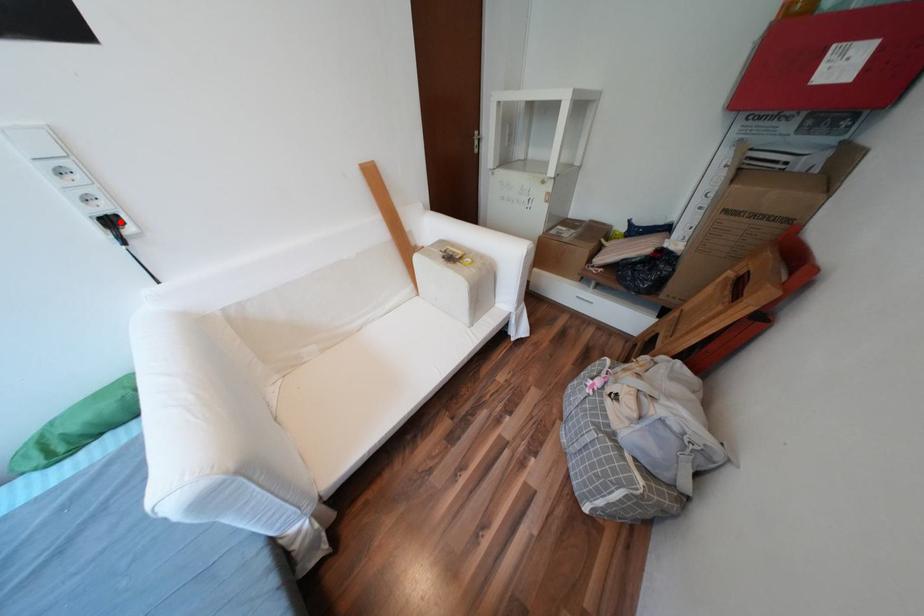
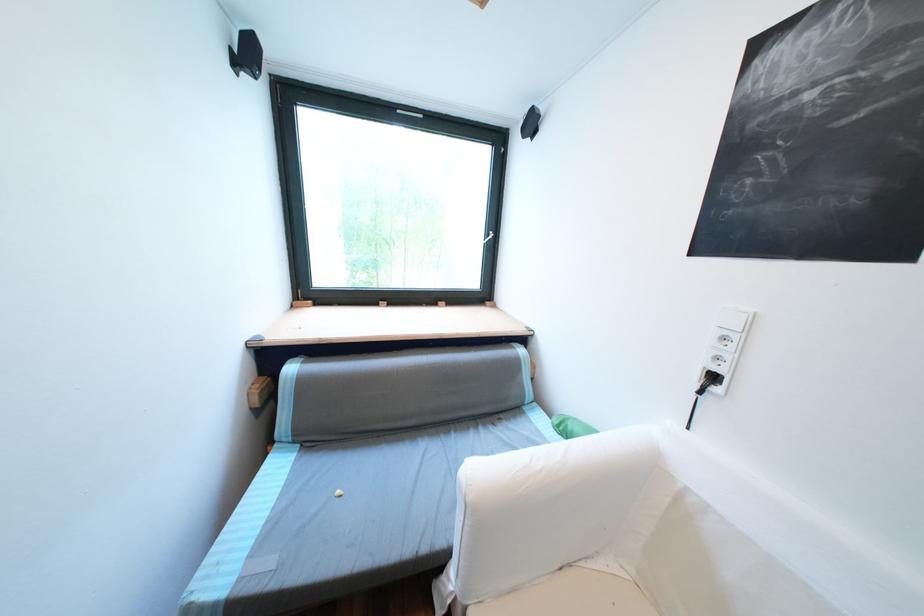
Locate, in the second image, the point that corresponds to the highlighted location in the first image.

(723, 378)